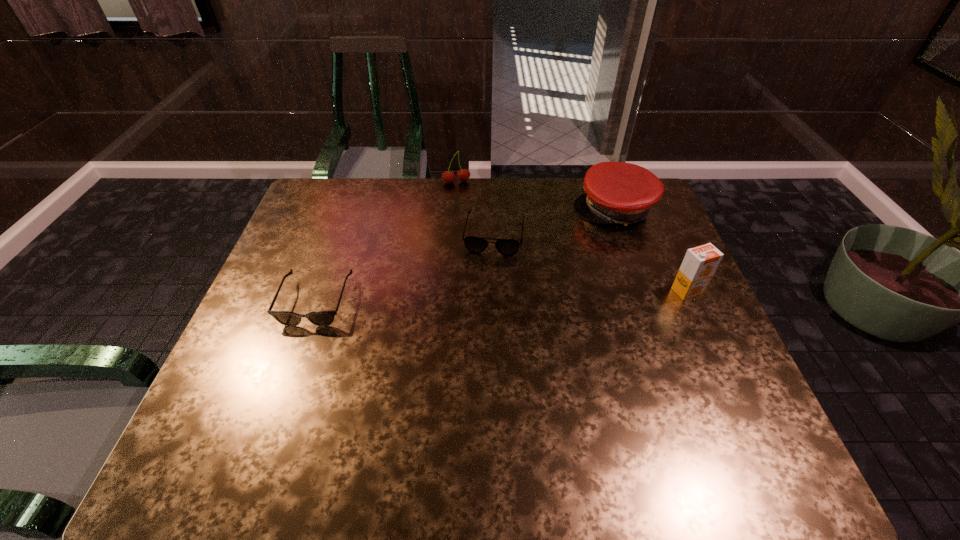
Where is `free space between the leftmost object and the orange juice`? free space between the leftmost object and the orange juice is located at coordinates (502, 296).

In order to click on free space between the tallest object and the sunglasses in this screenshot , I will do `click(502, 296)`.

Identify the location of free space between the leftmost object and the cap. (465, 255).

This screenshot has width=960, height=540. What are the coordinates of `unoccupied position between the leftmost object and the spectacles` in the screenshot? It's located at coord(405,268).

Locate an element on the screen. vacant point located between the spectacles and the tallest object is located at coordinates (591, 262).

The width and height of the screenshot is (960, 540). Find the location of `vacant space that's between the cap and the farthest object`. vacant space that's between the cap and the farthest object is located at coordinates (535, 197).

Where is `free space between the sunglasses and the cherry`? free space between the sunglasses and the cherry is located at coordinates (386, 242).

At what (x,y) coordinates should I click in order to perform the action: click on free spot between the orange juice and the leftmost object. Please return your answer as a coordinate pair (x, y). Looking at the image, I should click on [502, 296].

This screenshot has width=960, height=540. What are the coordinates of `free space between the leftmost object and the cap` in the screenshot? It's located at (465, 255).

Image resolution: width=960 pixels, height=540 pixels. What are the coordinates of `the closest object to the tallest object` in the screenshot? It's located at click(x=616, y=192).